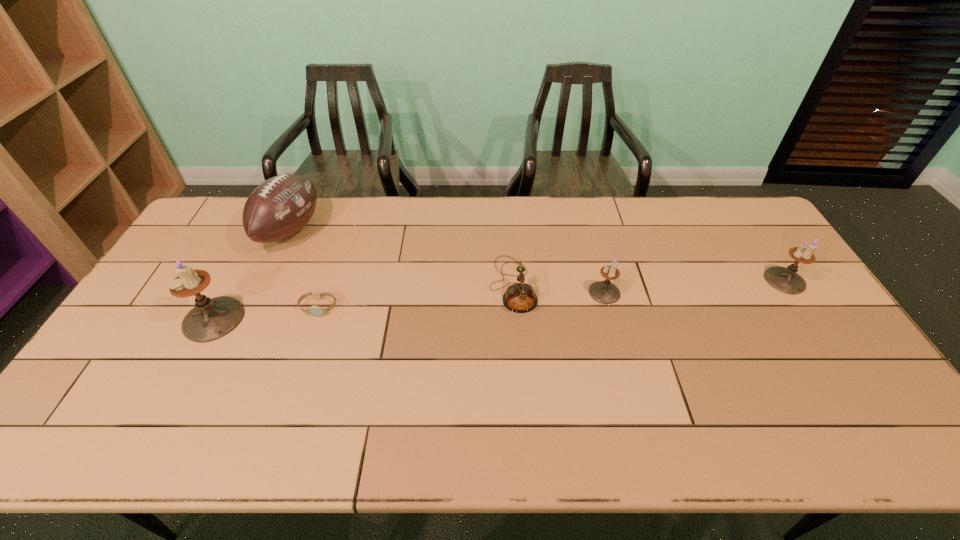
Image resolution: width=960 pixels, height=540 pixels. What are the coordinates of `vacant position for inserting another candle_holder evenly` in the screenshot? It's located at (415, 305).